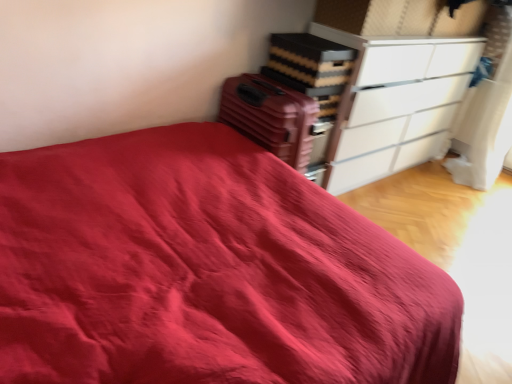
Question: Does matte plastic suitcase at center-right come in front of white glossy chest of drawers at upper right?

Choices:
 (A) yes
 (B) no

Answer: (A)

Question: From the image's perspective, would you say matte plastic suitcase at center-right is shown under white glossy chest of drawers at upper right?

Choices:
 (A) no
 (B) yes

Answer: (B)

Question: Can you confirm if matte plastic suitcase at center-right is positioned to the right of white glossy chest of drawers at upper right?

Choices:
 (A) yes
 (B) no

Answer: (B)

Question: Is matte plastic suitcase at center-right directly adjacent to white glossy chest of drawers at upper right?

Choices:
 (A) no
 (B) yes

Answer: (A)

Question: Is matte plastic suitcase at center-right taller than white glossy chest of drawers at upper right?

Choices:
 (A) no
 (B) yes

Answer: (A)

Question: Does matte plastic suitcase at center-right have a greater width compared to white glossy chest of drawers at upper right?

Choices:
 (A) no
 (B) yes

Answer: (B)

Question: Can you confirm if white glossy chest of drawers at upper right is thinner than matte plastic suitcase at center-right?

Choices:
 (A) yes
 (B) no

Answer: (A)

Question: Is white glossy chest of drawers at upper right smaller than matte plastic suitcase at center-right?

Choices:
 (A) no
 (B) yes

Answer: (A)

Question: Is white glossy chest of drawers at upper right not close to matte plastic suitcase at center-right?

Choices:
 (A) no
 (B) yes

Answer: (A)

Question: Is white glossy chest of drawers at upper right bigger than matte plastic suitcase at center-right?

Choices:
 (A) yes
 (B) no

Answer: (A)

Question: From the image's perspective, is white glossy chest of drawers at upper right over matte plastic suitcase at center-right?

Choices:
 (A) no
 (B) yes

Answer: (B)

Question: Is matte plastic suitcase at center-right completely or partially inside white glossy chest of drawers at upper right?

Choices:
 (A) no
 (B) yes

Answer: (A)

Question: Is white glossy chest of drawers at upper right spatially inside matte plastic suitcase at center-right, or outside of it?

Choices:
 (A) outside
 (B) inside

Answer: (A)